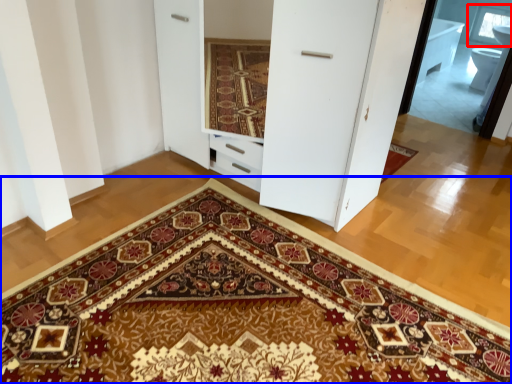
Question: Which object appears farthest to the camera in this image, window (highlighted by a red box) or doormat (highlighted by a blue box)?

Choices:
 (A) window
 (B) doormat

Answer: (A)